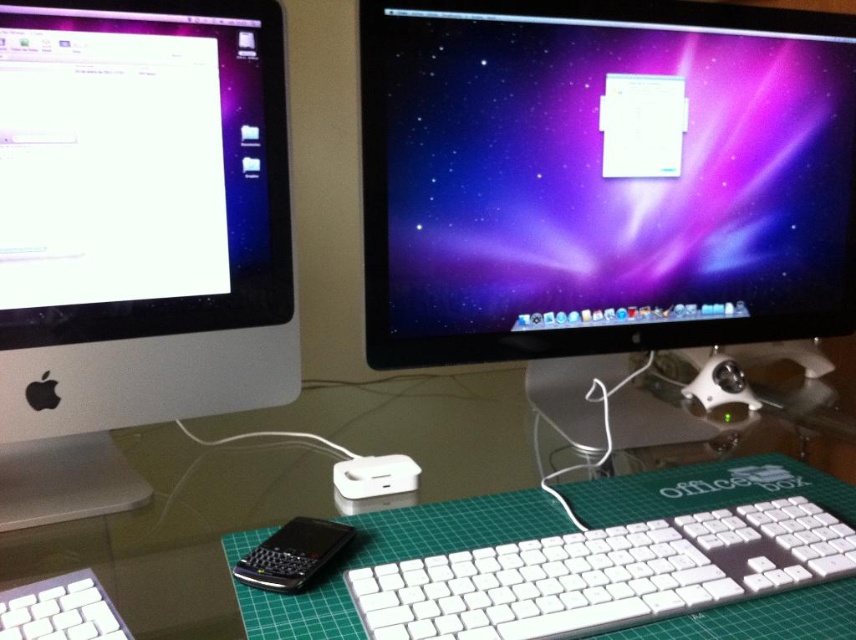
Who is positioned more to the left, satin black monitor at center or white glossy computer monitor at left?

white glossy computer monitor at left is more to the left.

Is satin black monitor at center shorter than white glossy computer monitor at left?

Indeed, satin black monitor at center has a lesser height compared to white glossy computer monitor at left.

You are a GUI agent. You are given a task and a screenshot of the screen. Output one action in this format:
    pyautogui.click(x=<x>, y=<y>)
    Task: Click on the satin black monitor at center
    The image size is (856, 640).
    Given the screenshot: What is the action you would take?
    pyautogui.click(x=599, y=179)

Between satin black monitor at center and white plastic keyboard at center, which one appears on the left side from the viewer's perspective?

Positioned to the left is white plastic keyboard at center.

From the picture: Can you confirm if satin black monitor at center is positioned to the left of white plastic keyboard at center?

In fact, satin black monitor at center is to the right of white plastic keyboard at center.

Between point (385, 90) and point (557, 584), which one is positioned behind?

Positioned behind is point (385, 90).

Where is `satin black monitor at center`? Image resolution: width=856 pixels, height=640 pixels. satin black monitor at center is located at coordinates (599, 179).

Is white plastic keyboard at lower left shorter than transparent glass computer desk at center?

Yes, white plastic keyboard at lower left is shorter than transparent glass computer desk at center.

Does white plastic keyboard at lower left come behind transparent glass computer desk at center?

No.

Is point (51, 609) positioned in front of point (848, 353)?

Yes, it is.

Locate an element on the screen. This screenshot has height=640, width=856. white plastic keyboard at lower left is located at coordinates (60, 611).